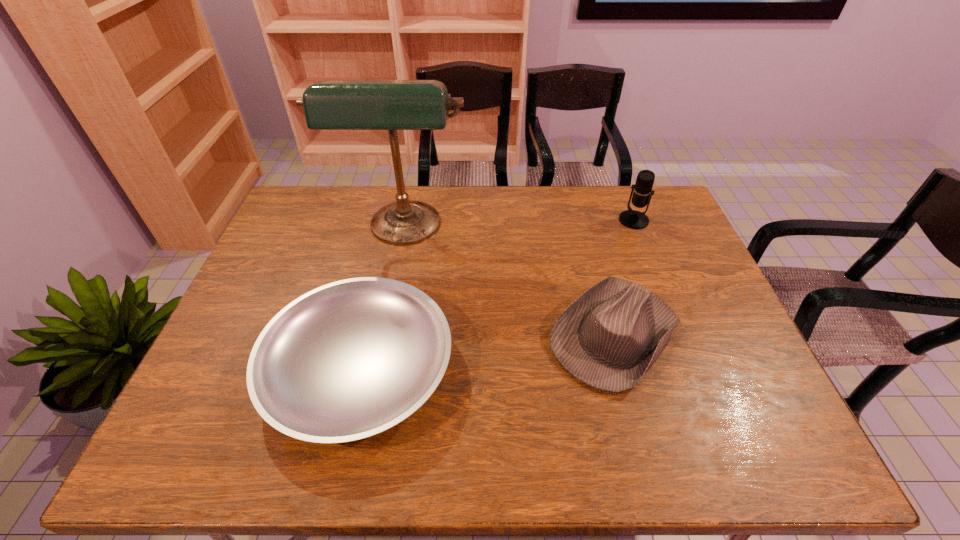
This screenshot has height=540, width=960. Find the location of `the tallest object`. the tallest object is located at coordinates (392, 105).

Locate an element on the screen. The image size is (960, 540). the second tallest object is located at coordinates (633, 219).

You are a GUI agent. You are given a task and a screenshot of the screen. Output one action in this format:
    pyautogui.click(x=<x>, y=<y>)
    Task: Click on the fedora
    This screenshot has height=540, width=960.
    Given the screenshot: What is the action you would take?
    pyautogui.click(x=608, y=338)

Where is `the shortest object`? the shortest object is located at coordinates (351, 359).

Locate an element on the screen. blank space located above the green lampshade of the tallest object is located at coordinates (381, 351).

At what (x,y) coordinates should I click in order to perform the action: click on vacant space located 0.190m on the left of the microphone. Please return your answer as a coordinate pair (x, y). Image resolution: width=960 pixels, height=540 pixels. Looking at the image, I should click on (564, 220).

Locate an element on the screen. The height and width of the screenshot is (540, 960). free space located 0.130m on the right of the fedora is located at coordinates (733, 335).

The image size is (960, 540). What are the coordinates of `blank area located 0.400m on the back of the shortest object` in the screenshot? It's located at (395, 214).

This screenshot has height=540, width=960. What are the coordinates of `table lamp at the far edge` in the screenshot? It's located at (392, 105).

Identify the location of microphone that is positioned at the far edge. tap(633, 219).